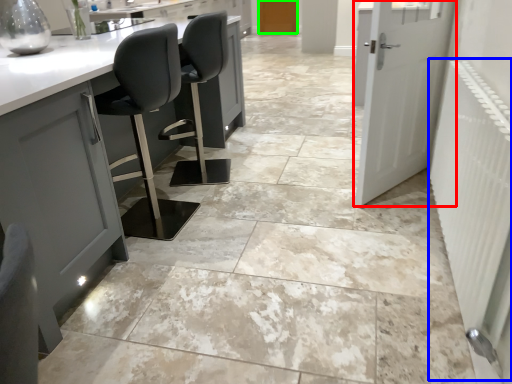
Question: Which object is positioned closest to door (highlighted by a red box)? Select from radiator (highlighted by a blue box) and door (highlighted by a green box).

Choices:
 (A) radiator
 (B) door

Answer: (A)